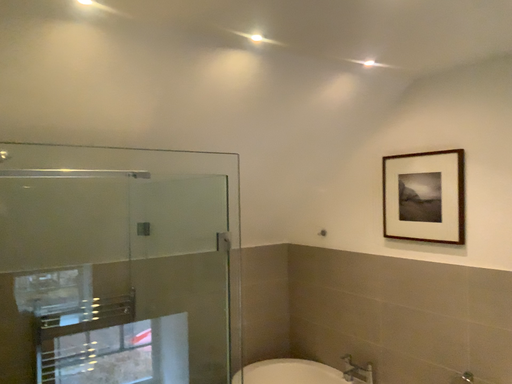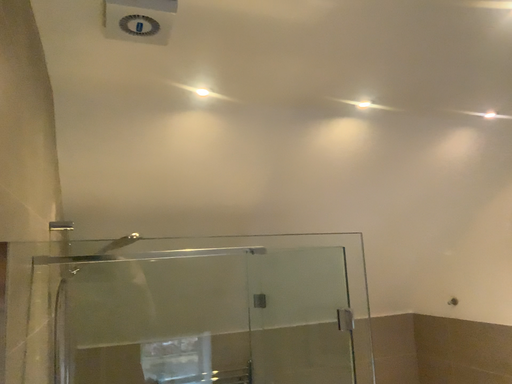
Question: Which way did the camera rotate in the video?

Choices:
 (A) rotated right
 (B) rotated left

Answer: (B)